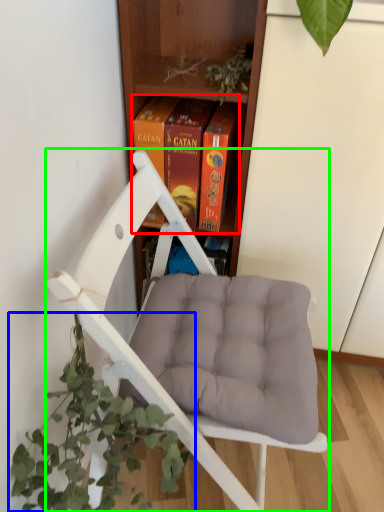
Question: Which is nearer to the book (highlighted by a red box)? houseplant (highlighted by a blue box) or chair (highlighted by a green box).

Choices:
 (A) houseplant
 (B) chair

Answer: (B)